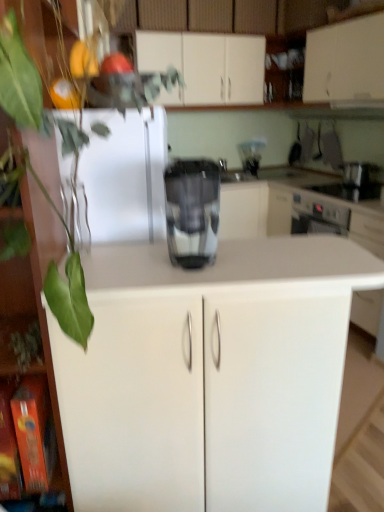
Question: From the image's perspective, is metallic silver toaster at upper right, the 1th appliance in the top-to-bottom sequence, located above or below black glass stove at upper right, the first appliance from the bottom?

Choices:
 (A) above
 (B) below

Answer: (A)

Question: In terms of height, does metallic silver toaster at upper right, marked as the 2th appliance in a bottom-to-top arrangement, look taller or shorter compared to black glass stove at upper right, the 2th appliance when ordered from top to bottom?

Choices:
 (A) tall
 (B) short

Answer: (A)

Question: Which is farther from the metallic silver toaster at upper right, the 1th appliance in the top-to-bottom sequence?

Choices:
 (A) green leafy plant at left
 (B) white matte cabinet at upper center, which is the 3th cabinetry in front-to-back order
 (C) white matte cabinet at upper center, which is counted as the first cabinetry, starting from the back
 (D) white matte cabinet at left, which is counted as the 1th cabinetry, starting from the front
 (E) white matte cabinet at center, positioned as the 2th cabinetry in front-to-back order

Answer: (D)

Question: Which is nearer to the metallic silver toaster at upper right, marked as the 2th appliance in a bottom-to-top arrangement?

Choices:
 (A) black glass stove at upper right, the 2th appliance when ordered from top to bottom
 (B) green leafy plant at left
 (C) metallic silver coffee maker at center
 (D) white matte cabinet at upper center, which is the 3th cabinetry in front-to-back order
 (E) white matte cabinet at left, which is counted as the 1th cabinetry, starting from the front

Answer: (A)